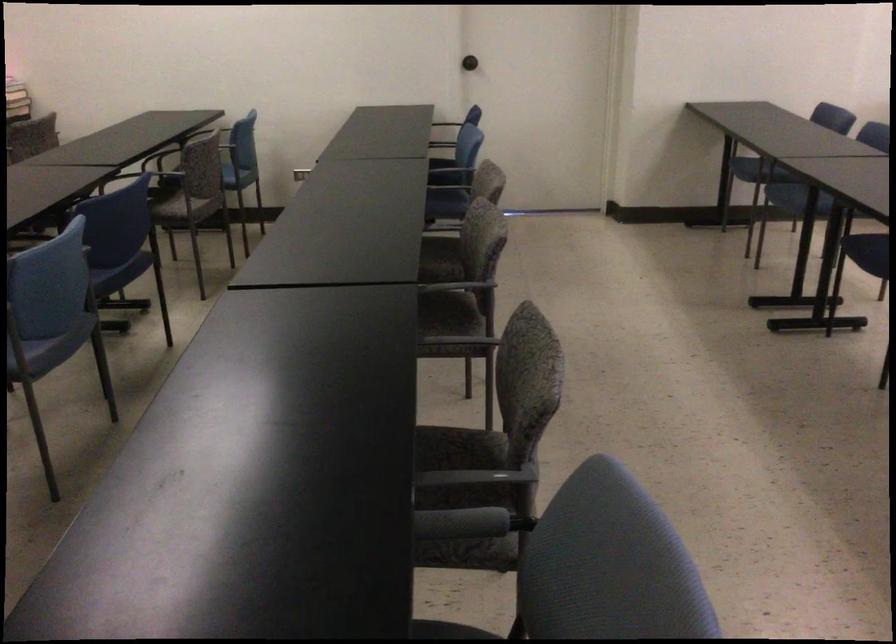
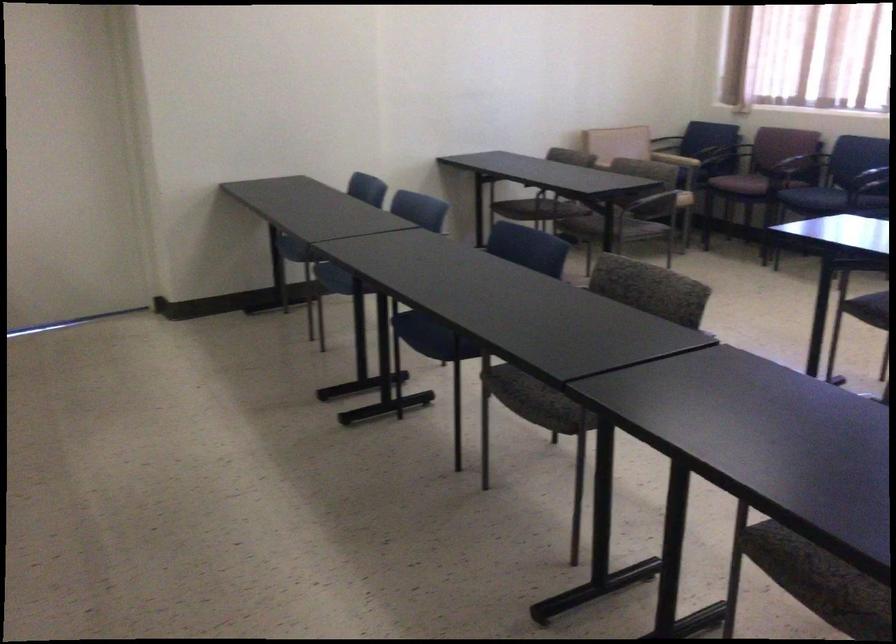
What movement of the cameraman would produce the second image?

The cameraman moved toward right, forward.